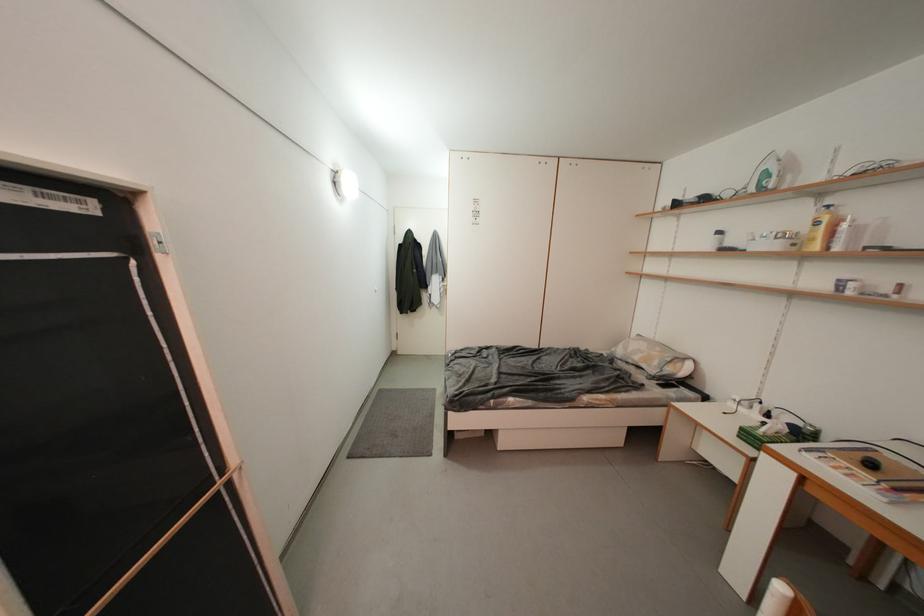
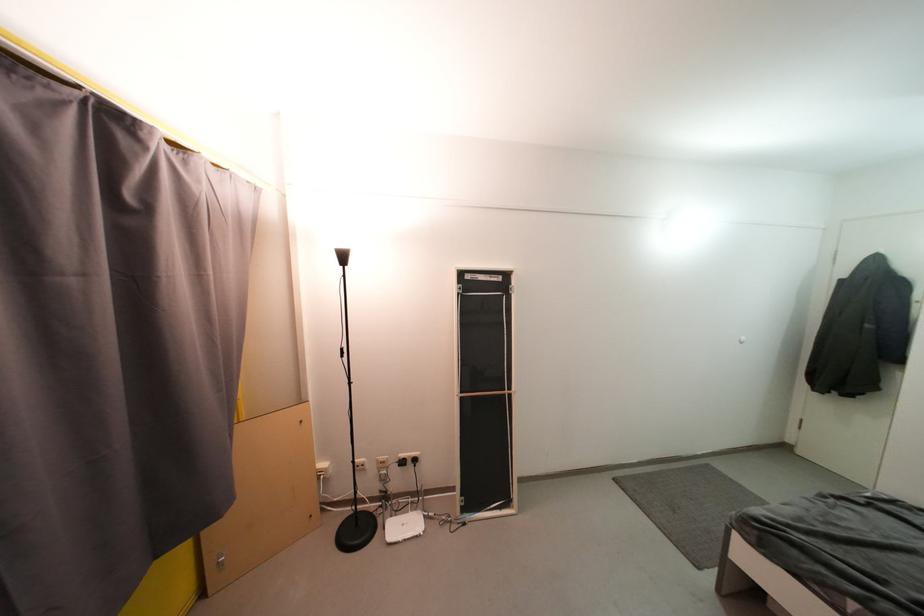
Question: How did the camera likely rotate?

Choices:
 (A) Left
 (B) Right
 (C) Up
 (D) Down

Answer: (A)